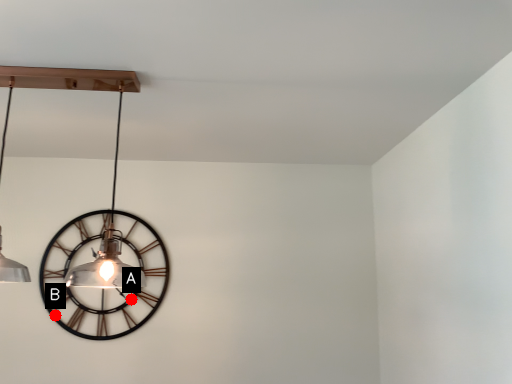
Question: Two points are circled on the image, labeled by A and B beside each circle. Which point appears closest to the camera in this image?

Choices:
 (A) A is closer
 (B) B is closer

Answer: (B)